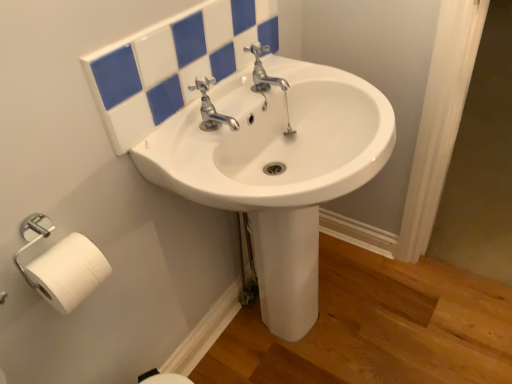
Question: Can you confirm if white matte toilet paper at lower left is positioned to the right of white glossy mirror at upper center?

Choices:
 (A) yes
 (B) no

Answer: (B)

Question: From a real-world perspective, is white matte toilet paper at lower left below white glossy mirror at upper center?

Choices:
 (A) yes
 (B) no

Answer: (A)

Question: Can you confirm if white matte toilet paper at lower left is smaller than white glossy mirror at upper center?

Choices:
 (A) yes
 (B) no

Answer: (A)

Question: Can you confirm if white matte toilet paper at lower left is taller than white glossy mirror at upper center?

Choices:
 (A) yes
 (B) no

Answer: (B)

Question: Can we say white matte toilet paper at lower left lies outside white glossy mirror at upper center?

Choices:
 (A) yes
 (B) no

Answer: (A)

Question: Does white matte toilet paper at lower left have a greater width compared to white glossy mirror at upper center?

Choices:
 (A) yes
 (B) no

Answer: (A)

Question: From a real-world perspective, is chrome metallic faucet at center under white glossy mirror at upper center?

Choices:
 (A) yes
 (B) no

Answer: (A)

Question: Is white glossy mirror at upper center located within chrome metallic faucet at center?

Choices:
 (A) no
 (B) yes

Answer: (A)

Question: Can we say chrome metallic faucet at center lies outside white glossy mirror at upper center?

Choices:
 (A) yes
 (B) no

Answer: (A)

Question: From a real-world perspective, is chrome metallic faucet at center on top of white glossy mirror at upper center?

Choices:
 (A) yes
 (B) no

Answer: (B)

Question: Is chrome metallic faucet at center positioned with its back to white glossy mirror at upper center?

Choices:
 (A) no
 (B) yes

Answer: (B)

Question: Is chrome metallic faucet at center closer to the viewer compared to white glossy mirror at upper center?

Choices:
 (A) no
 (B) yes

Answer: (A)

Question: Is white glossy mirror at upper center located outside chrome metallic faucet at center?

Choices:
 (A) yes
 (B) no

Answer: (A)